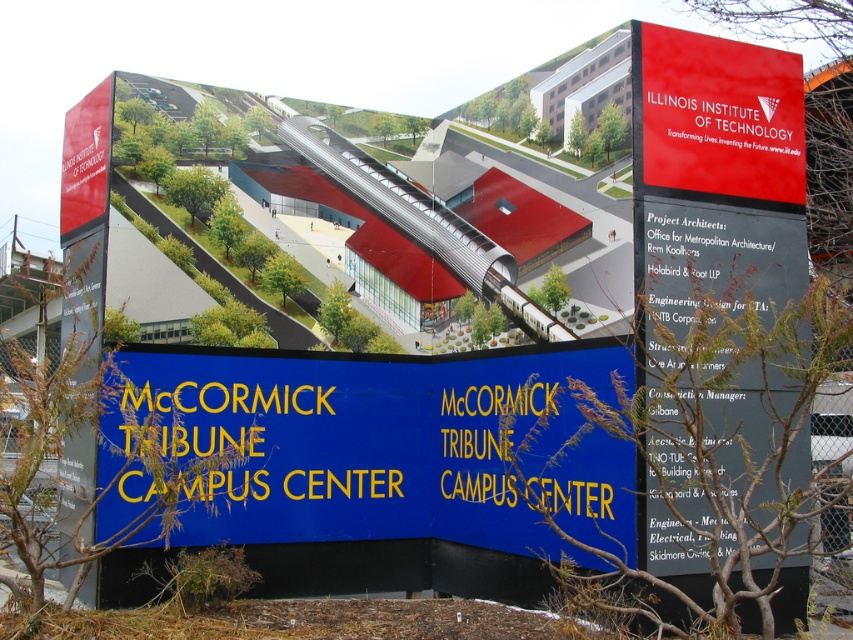
Is blue metallic sign at center below black matte sign at upper right?

Indeed, blue metallic sign at center is positioned under black matte sign at upper right.

Does blue metallic sign at center appear on the right side of black matte sign at upper right?

No, blue metallic sign at center is not to the right of black matte sign at upper right.

Which is in front, point (306, 362) or point (693, 518)?

Point (693, 518) is in front.

You are a GUI agent. You are given a task and a screenshot of the screen. Output one action in this format:
    pyautogui.click(x=<x>, y=<y>)
    Task: Click on the blue metallic sign at center
    
    Given the screenshot: What is the action you would take?
    pyautogui.click(x=387, y=445)

Which is above, blue metallic sign at center or red matte sign at upper right?

red matte sign at upper right is higher up.

Who is more distant from viewer, (526, 532) or (726, 136)?

The point (526, 532) is more distant.

The width and height of the screenshot is (853, 640). I want to click on blue metallic sign at center, so click(x=387, y=445).

Does black matte sign at upper right have a smaller size compared to red matte sign at upper right?

Incorrect, black matte sign at upper right is not smaller in size than red matte sign at upper right.

Is point (677, 481) behind point (728, 160)?

No, (677, 481) is in front of (728, 160).

Does point (712, 472) come farther from viewer compared to point (723, 44)?

No, (712, 472) is closer to viewer.

The image size is (853, 640). Identify the location of black matte sign at upper right. (708, 358).